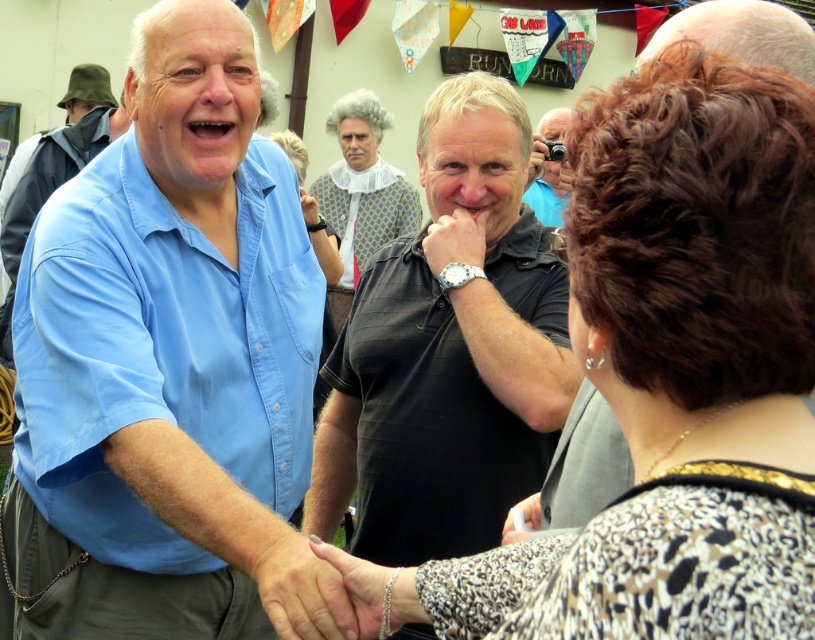
Question: In this image, where is black smooth shirt at center located relative to white lace collar at center?

Choices:
 (A) left
 (B) right

Answer: (B)

Question: Which object appears farthest from the camera in this image?

Choices:
 (A) black smooth shirt at center
 (B) leopard print blouse at center
 (C) white lace collar at center

Answer: (C)

Question: Can you confirm if black smooth shirt at center is bigger than white lace collar at center?

Choices:
 (A) no
 (B) yes

Answer: (A)

Question: Which object is farther from the camera taking this photo?

Choices:
 (A) blue cotton shirt at left
 (B) leopard print blouse at center
 (C) black smooth shirt at center

Answer: (C)

Question: Can you confirm if white lace collar at center is thinner than matte black camera at upper center?

Choices:
 (A) yes
 (B) no

Answer: (B)

Question: Among these points, which one is farthest from the camera?

Choices:
 (A) (756, 326)
 (B) (447, 234)
 (C) (549, 220)

Answer: (C)